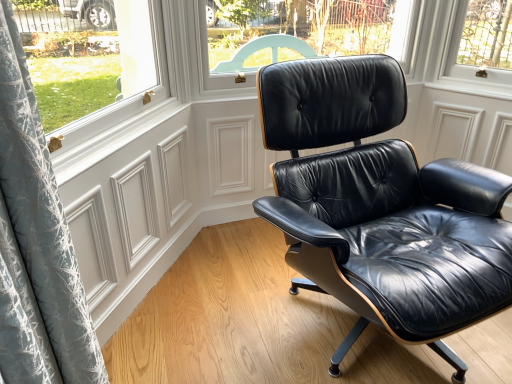
Question: From the image's perspective, is white matte screen door at lower left below black leather chair at center?

Choices:
 (A) no
 (B) yes

Answer: (B)

Question: Is white matte screen door at lower left bigger than black leather chair at center?

Choices:
 (A) no
 (B) yes

Answer: (A)

Question: Does white matte screen door at lower left appear on the right side of black leather chair at center?

Choices:
 (A) no
 (B) yes

Answer: (A)

Question: Is white matte screen door at lower left not near black leather chair at center?

Choices:
 (A) no
 (B) yes

Answer: (A)

Question: Can you confirm if white matte screen door at lower left is positioned to the left of black leather chair at center?

Choices:
 (A) no
 (B) yes

Answer: (B)

Question: Is white matte screen door at lower left further to the viewer compared to black leather chair at center?

Choices:
 (A) no
 (B) yes

Answer: (B)

Question: From a real-world perspective, is black leather chair at center on white matte screen door at lower left?

Choices:
 (A) yes
 (B) no

Answer: (A)

Question: Is the position of black leather chair at center less distant than that of white matte screen door at lower left?

Choices:
 (A) no
 (B) yes

Answer: (B)

Question: Can you confirm if black leather chair at center is positioned to the left of white matte screen door at lower left?

Choices:
 (A) yes
 (B) no

Answer: (B)

Question: Does black leather chair at center have a lesser width compared to white matte screen door at lower left?

Choices:
 (A) no
 (B) yes

Answer: (A)

Question: Can you confirm if black leather chair at center is bigger than white matte screen door at lower left?

Choices:
 (A) no
 (B) yes

Answer: (B)

Question: Could you tell me if black leather chair at center is turned towards white matte screen door at lower left?

Choices:
 (A) yes
 (B) no

Answer: (B)

Question: From the image's perspective, is white matte screen door at lower left positioned above or below black leather chair at center?

Choices:
 (A) below
 (B) above

Answer: (A)